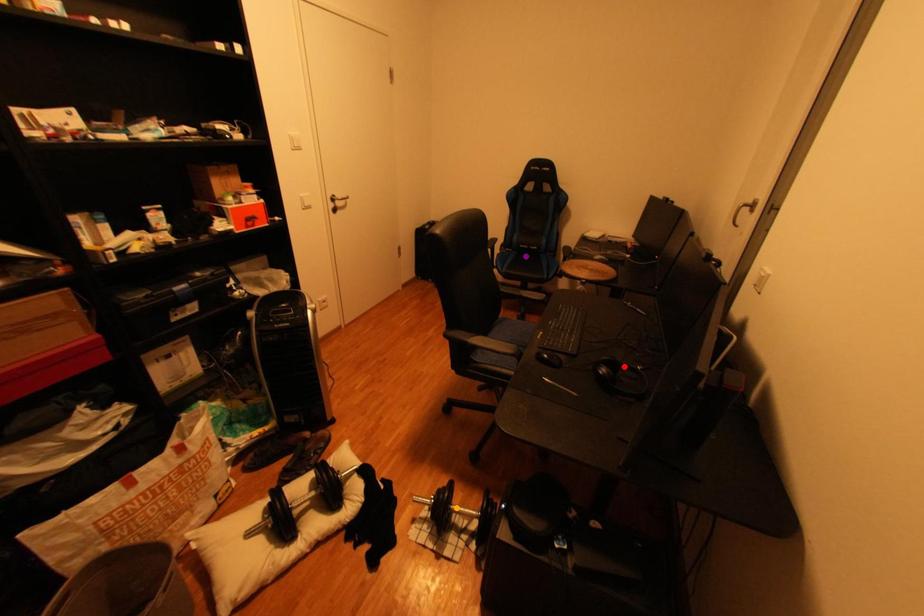
Order these from nearest to farthest:
red point | purple point | orange point

red point < orange point < purple point